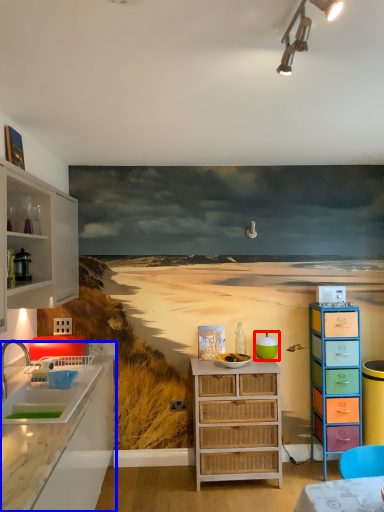
Question: Which point is further to the camera, teal (highlighted by a red box) or countertop (highlighted by a blue box)?

Choices:
 (A) teal
 (B) countertop

Answer: (A)